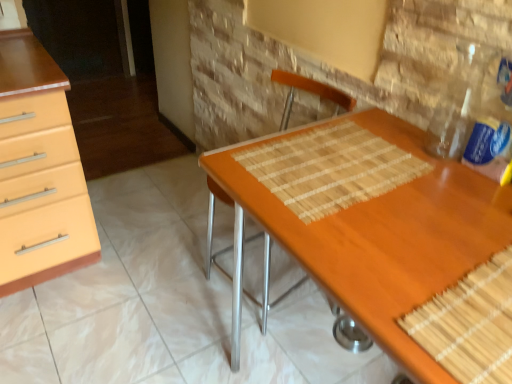
This screenshot has width=512, height=384. Find the location of `vacant space situated above wooden desk at center (from a real-world perspective)`. vacant space situated above wooden desk at center (from a real-world perspective) is located at coordinates (394, 206).